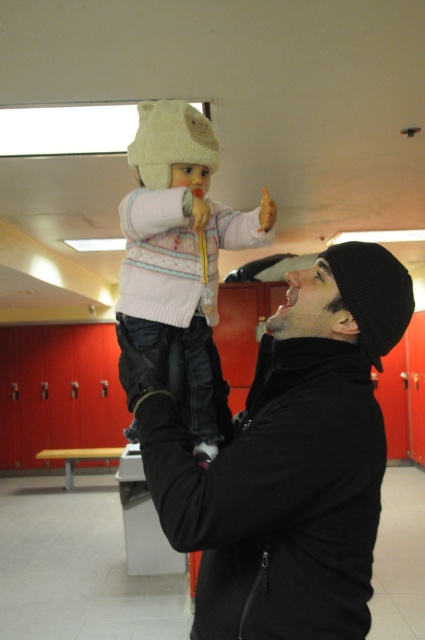
Question: Can you confirm if black matte jacket at center is positioned below white knitted sweater at center?

Choices:
 (A) no
 (B) yes

Answer: (B)

Question: Does black matte jacket at center have a smaller size compared to white knitted sweater at center?

Choices:
 (A) no
 (B) yes

Answer: (A)

Question: Which point is farther to the camera?

Choices:
 (A) (314, 554)
 (B) (186, 294)

Answer: (B)

Question: Which point is farther to the camera?

Choices:
 (A) white knitted sweater at center
 (B) black matte jacket at center

Answer: (A)

Question: Is black matte jacket at center above white knitted sweater at center?

Choices:
 (A) yes
 (B) no

Answer: (B)